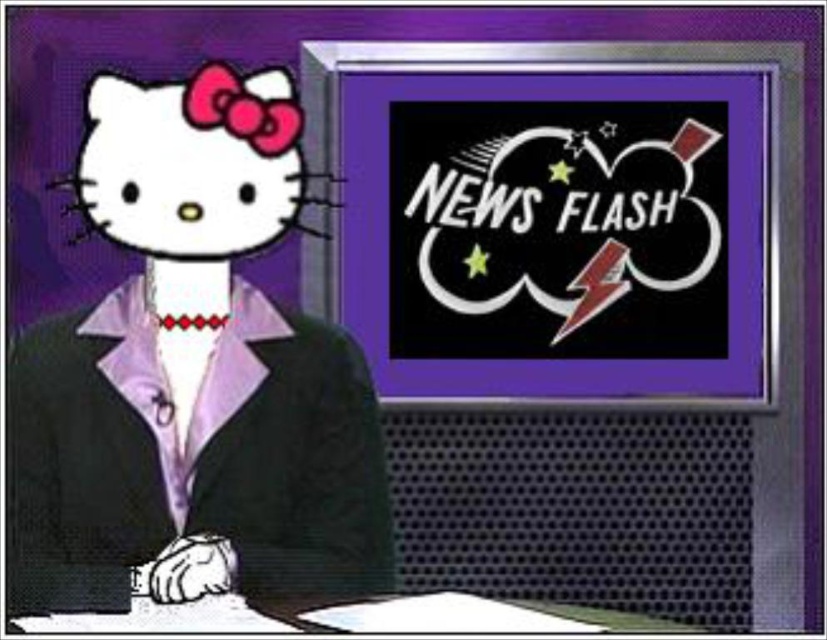
Is black glossy screen at upper right closer to the viewer compared to white matte hello kitty head at upper left?

No, it is not.

Is point (572, 124) less distant than point (122, 173)?

No, it is behind (122, 173).

Where is `black glossy screen at upper right`? black glossy screen at upper right is located at coordinates (553, 227).

Identify the location of black glossy screen at upper right. The height and width of the screenshot is (640, 827). (553, 227).

Can you confirm if black matte business suit at center is shorter than white matte hello kitty head at upper left?

In fact, black matte business suit at center may be taller than white matte hello kitty head at upper left.

Between black matte business suit at center and white matte hello kitty head at upper left, which one appears on the right side from the viewer's perspective?

black matte business suit at center is more to the right.

Locate an element on the screen. This screenshot has width=827, height=640. black matte business suit at center is located at coordinates (190, 456).

Locate an element on the screen. This screenshot has height=640, width=827. black matte business suit at center is located at coordinates (190, 456).

Does white matte hello kitty head at upper left appear on the right side of white paper at lower center?

Incorrect, white matte hello kitty head at upper left is not on the right side of white paper at lower center.

Between point (156, 240) and point (557, 612), which one is positioned in front?

Positioned in front is point (557, 612).

The width and height of the screenshot is (827, 640). Identify the location of white matte hello kitty head at upper left. (192, 163).

This screenshot has width=827, height=640. I want to click on white matte hello kitty head at upper left, so click(x=192, y=163).